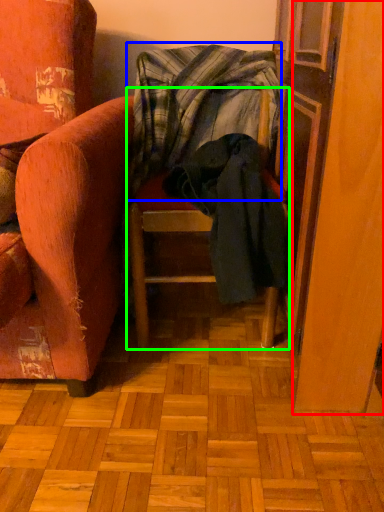
Question: Which is nearer to the screen door (highlighted by a red box)? blanket (highlighted by a blue box) or furniture (highlighted by a green box).

Choices:
 (A) blanket
 (B) furniture

Answer: (B)